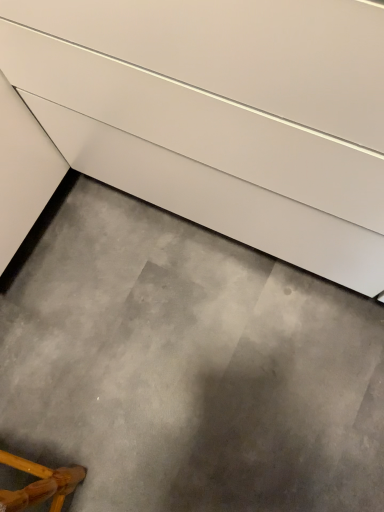
This screenshot has height=512, width=384. What are the coordinates of `free area below wooden chair at lower left (from a real-world perspective)` in the screenshot? It's located at [x=50, y=468].